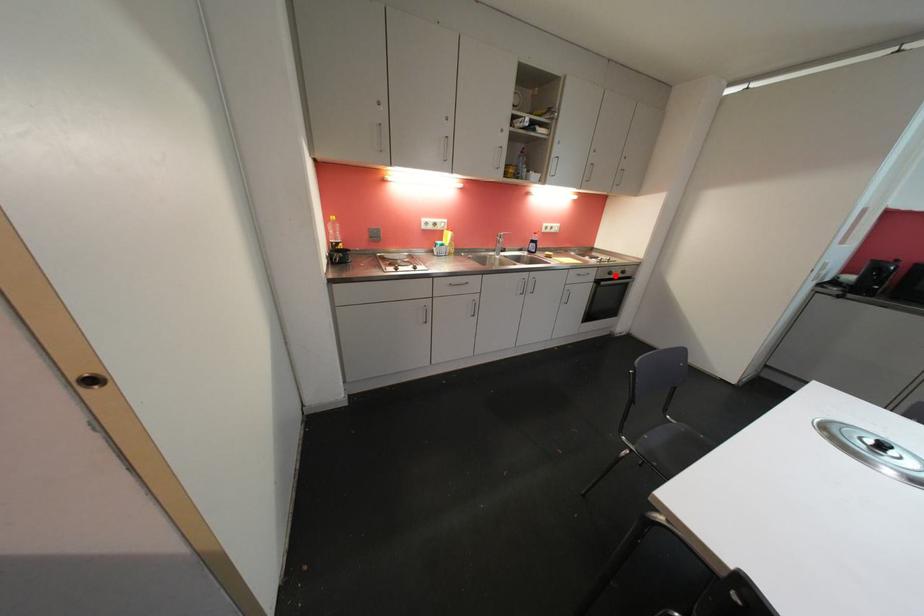
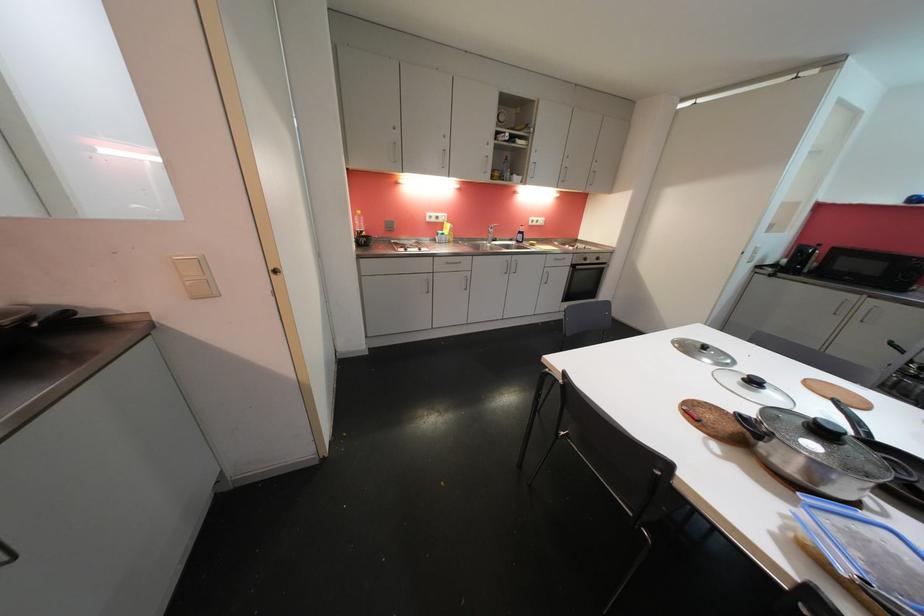
The point at the highlighted location is marked in the first image. Where is the corresponding point in the second image?

(590, 262)